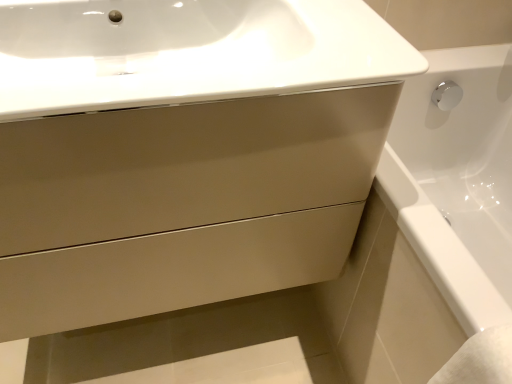
Locate an element on the screen. Image resolution: width=512 pixels, height=384 pixels. matte beige drawer at center is located at coordinates (186, 165).

The image size is (512, 384). What do you see at coordinates (186, 165) in the screenshot?
I see `matte beige drawer at center` at bounding box center [186, 165].

This screenshot has height=384, width=512. I want to click on white glossy sink at upper center, so click(188, 52).

What do you see at coordinates (188, 52) in the screenshot?
I see `white glossy sink at upper center` at bounding box center [188, 52].

In order to face white glossy sink at upper center, should I rotate leftwards or rightwards?

You should look left and rotate roughly 10.522 degrees.

The image size is (512, 384). What are the coordinates of `matte beige drawer at center` in the screenshot? It's located at (186, 165).

Is white glossy sink at upper center to the left or to the right of matte beige drawer at center in the image?

Based on their positions, white glossy sink at upper center is located to the right of matte beige drawer at center.

Based on the photo, considering the relative positions of white glossy sink at upper center and matte beige drawer at center in the image provided, is white glossy sink at upper center behind matte beige drawer at center?

No, it is in front of matte beige drawer at center.

Which is nearer, (296, 31) or (186, 140)?

Positioned in front is point (186, 140).

From the image's perspective, relative to matte beige drawer at center, is white glossy sink at upper center above or below?

Clearly, from the image's perspective, white glossy sink at upper center is above matte beige drawer at center.

From a real-world perspective, is white glossy sink at upper center physically above matte beige drawer at center?

Yes.

Which of these two, white glossy sink at upper center or matte beige drawer at center, is thinner?

With smaller width is matte beige drawer at center.

Can you confirm if white glossy sink at upper center is taller than matte beige drawer at center?

In fact, white glossy sink at upper center may be shorter than matte beige drawer at center.

Who is smaller, white glossy sink at upper center or matte beige drawer at center?

With smaller size is white glossy sink at upper center.

Can we say white glossy sink at upper center lies outside matte beige drawer at center?

That's incorrect, white glossy sink at upper center is not completely outside matte beige drawer at center.

Are white glossy sink at upper center and matte beige drawer at center located far from each other?

Actually, white glossy sink at upper center and matte beige drawer at center are a little close together.

Is white glossy sink at upper center facing towards matte beige drawer at center?

Yes, white glossy sink at upper center is facing matte beige drawer at center.

How many degrees apart are the facing directions of white glossy sink at upper center and matte beige drawer at center?

0.00112 degrees.

Measure the distance from white glossy sink at upper center to matte beige drawer at center.

white glossy sink at upper center and matte beige drawer at center are 5.92 inches apart.

Where is `drawer beneath the white glossy sink at upper center (from a real-world perspective)`? This screenshot has height=384, width=512. drawer beneath the white glossy sink at upper center (from a real-world perspective) is located at coordinates (186, 165).

Which is more to the right, matte beige drawer at center or white glossy sink at upper center?

Positioned to the right is white glossy sink at upper center.

Considering their positions, is matte beige drawer at center located in front of or behind white glossy sink at upper center?

matte beige drawer at center is behind white glossy sink at upper center.

Which point is more forward, (x=362, y=154) or (x=138, y=66)?

The point (x=362, y=154) is in front.

From the image's perspective, which is above, matte beige drawer at center or white glossy sink at upper center?

white glossy sink at upper center appears higher in the image.

From a real-world perspective, between matte beige drawer at center and white glossy sink at upper center, who is vertically lower?

matte beige drawer at center, from a real-world perspective.

Is matte beige drawer at center thinner than white glossy sink at upper center?

Yes.

Is matte beige drawer at center shorter than white glossy sink at upper center?

Incorrect, the height of matte beige drawer at center does not fall short of that of white glossy sink at upper center.

Can you confirm if matte beige drawer at center is bigger than white glossy sink at upper center?

Yes, matte beige drawer at center is bigger than white glossy sink at upper center.

Is matte beige drawer at center spatially inside white glossy sink at upper center, or outside of it?

matte beige drawer at center lies outside white glossy sink at upper center.

Are matte beige drawer at center and white glossy sink at upper center making contact?

matte beige drawer at center and white glossy sink at upper center are clearly separated.

Is matte beige drawer at center looking in the opposite direction of white glossy sink at upper center?

matte beige drawer at center does not have its back to white glossy sink at upper center.

What's the angular difference between matte beige drawer at center and white glossy sink at upper center's facing directions?

matte beige drawer at center and white glossy sink at upper center are facing 0.00112 degrees away from each other.

Measure the distance from matte beige drawer at center to white glossy sink at upper center.

The distance of matte beige drawer at center from white glossy sink at upper center is 5.92 inches.

Identify the location of sink above the matte beige drawer at center (from a real-world perspective). The width and height of the screenshot is (512, 384). (188, 52).

What are the coordinates of `sink above the matte beige drawer at center (from a real-world perspective)` in the screenshot? It's located at (188, 52).

At what (x,y) coordinates should I click in order to perform the action: click on drawer on the left of white glossy sink at upper center. Please return your answer as a coordinate pair (x, y). Looking at the image, I should click on (186, 165).